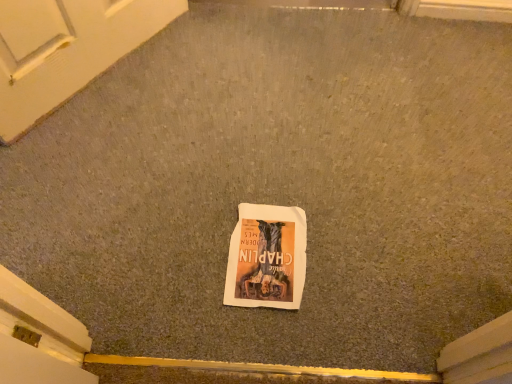
Where is `free spot above white paper at center (from a real-world perspective)`? This screenshot has height=384, width=512. free spot above white paper at center (from a real-world perspective) is located at coordinates (269, 252).